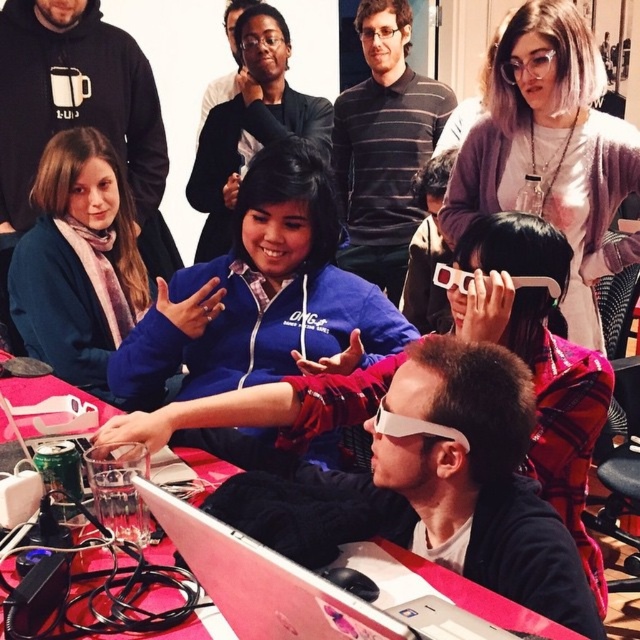
Question: Is white plastic laptop at center wider than matte blue hoodie at center?

Choices:
 (A) no
 (B) yes

Answer: (A)

Question: Can you confirm if metallic silver laptop at center is smaller than matte blue hoodie at center?

Choices:
 (A) yes
 (B) no

Answer: (B)

Question: Which point is closer to the camera?

Choices:
 (A) (273, 596)
 (B) (35, 196)

Answer: (A)

Question: Which point is farther from the camera taking this photo?

Choices:
 (A) (248, 589)
 (B) (317, 637)
 (C) (282, 122)
 (D) (81, 250)

Answer: (C)

Question: Which object is farther from the camera taking this photo?

Choices:
 (A) metallic silver laptop at center
 (B) matte blue hoodie at center
 (C) white plastic laptop at center

Answer: (B)

Question: Can you confirm if matte blue hoodie at center-left is positioned below white plastic laptop at center?

Choices:
 (A) yes
 (B) no

Answer: (B)